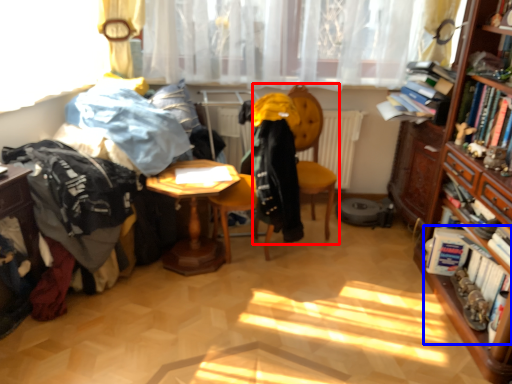
Question: Among these objects, which one is nearest to the camera, chair (highlighted by a red box) or book (highlighted by a blue box)?

Choices:
 (A) chair
 (B) book

Answer: (B)